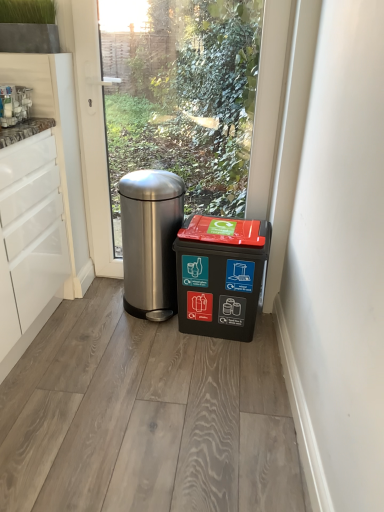
Identify the location of free space to the left of black plastic recycling bin at lower right, acting as the first waste container starting from the right. The image size is (384, 512). (138, 335).